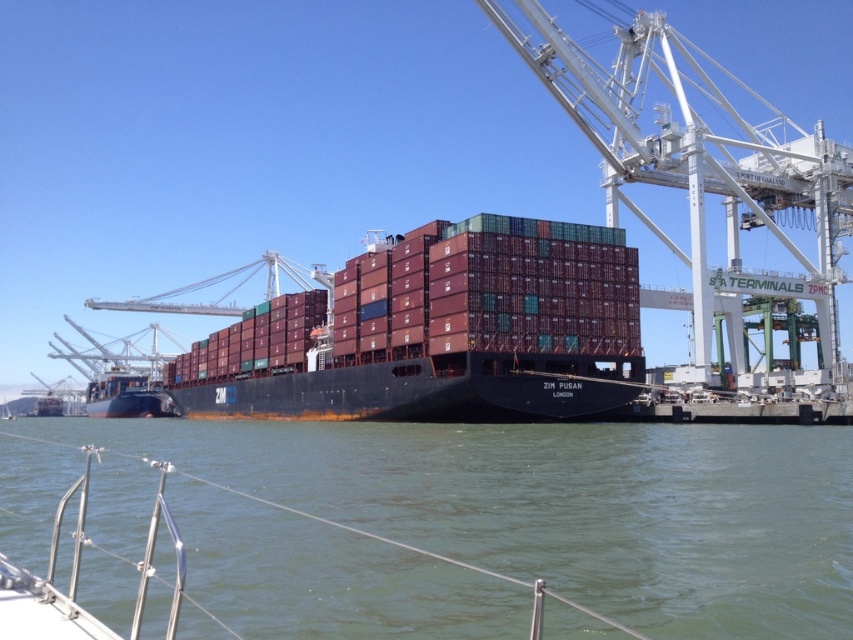
Between greenish water at lower center and maroon matte container ship at center, which one appears on the right side from the viewer's perspective?

Positioned to the right is greenish water at lower center.

Is greenish water at lower center to the left of maroon matte container ship at center from the viewer's perspective?

No, greenish water at lower center is not to the left of maroon matte container ship at center.

Which is in front, point (396, 481) or point (531, 396)?

Point (396, 481) is in front.

Where is `greenish water at lower center`? greenish water at lower center is located at coordinates (508, 506).

Which is below, greenish water at lower center or white metal crane at upper right?

greenish water at lower center is below.

Describe the element at coordinates (508, 506) in the screenshot. The width and height of the screenshot is (853, 640). I see `greenish water at lower center` at that location.

Is point (183, 426) in front of point (630, 60)?

No.

At what (x,y) coordinates should I click in order to perform the action: click on greenish water at lower center. Please return your answer as a coordinate pair (x, y). Looking at the image, I should click on (508, 506).

Who is positioned more to the right, maroon matte container ship at center or white metal crane at upper right?

white metal crane at upper right is more to the right.

Does maroon matte container ship at center have a greater height compared to white metal crane at upper right?

No, maroon matte container ship at center is not taller than white metal crane at upper right.

Does point (497, 220) come in front of point (640, 38)?

Yes, it is in front of point (640, 38).

Locate an element on the screen. Image resolution: width=853 pixels, height=640 pixels. maroon matte container ship at center is located at coordinates (445, 332).